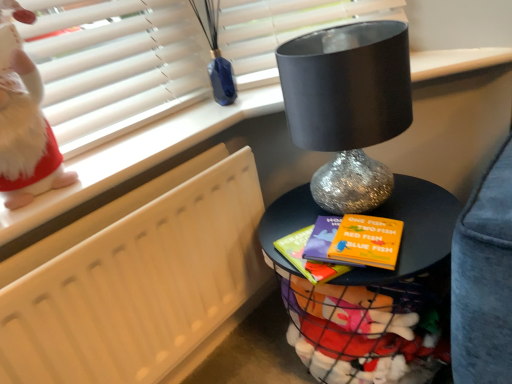
Question: Is white fluffy doll at upper left next to shiny metallic lamp at center and touching it?

Choices:
 (A) yes
 (B) no

Answer: (B)

Question: Is shiny metallic lamp at center at the back of white fluffy doll at upper left?

Choices:
 (A) yes
 (B) no

Answer: (B)

Question: Can you confirm if white fluffy doll at upper left is smaller than shiny metallic lamp at center?

Choices:
 (A) no
 (B) yes

Answer: (B)

Question: Considering the relative positions of white fluffy doll at upper left and shiny metallic lamp at center in the image provided, is white fluffy doll at upper left behind shiny metallic lamp at center?

Choices:
 (A) no
 (B) yes

Answer: (A)

Question: Considering the relative sizes of white fluffy doll at upper left and shiny metallic lamp at center in the image provided, is white fluffy doll at upper left taller than shiny metallic lamp at center?

Choices:
 (A) yes
 (B) no

Answer: (B)

Question: From the image's perspective, is white fluffy doll at upper left on top of shiny metallic lamp at center?

Choices:
 (A) no
 (B) yes

Answer: (B)

Question: Is white fluffy doll at upper left to the right of white matte radiator at left from the viewer's perspective?

Choices:
 (A) no
 (B) yes

Answer: (A)

Question: From the image's perspective, does white fluffy doll at upper left appear lower than white matte radiator at left?

Choices:
 (A) yes
 (B) no

Answer: (B)

Question: Is white fluffy doll at upper left bigger than white matte radiator at left?

Choices:
 (A) no
 (B) yes

Answer: (A)

Question: Can you confirm if white fluffy doll at upper left is wider than white matte radiator at left?

Choices:
 (A) no
 (B) yes

Answer: (B)

Question: Does white fluffy doll at upper left turn towards white matte radiator at left?

Choices:
 (A) yes
 (B) no

Answer: (B)

Question: Does white fluffy doll at upper left come behind white matte radiator at left?

Choices:
 (A) yes
 (B) no

Answer: (B)

Question: Is shiny metallic table at center touching white matte radiator at left?

Choices:
 (A) yes
 (B) no

Answer: (B)